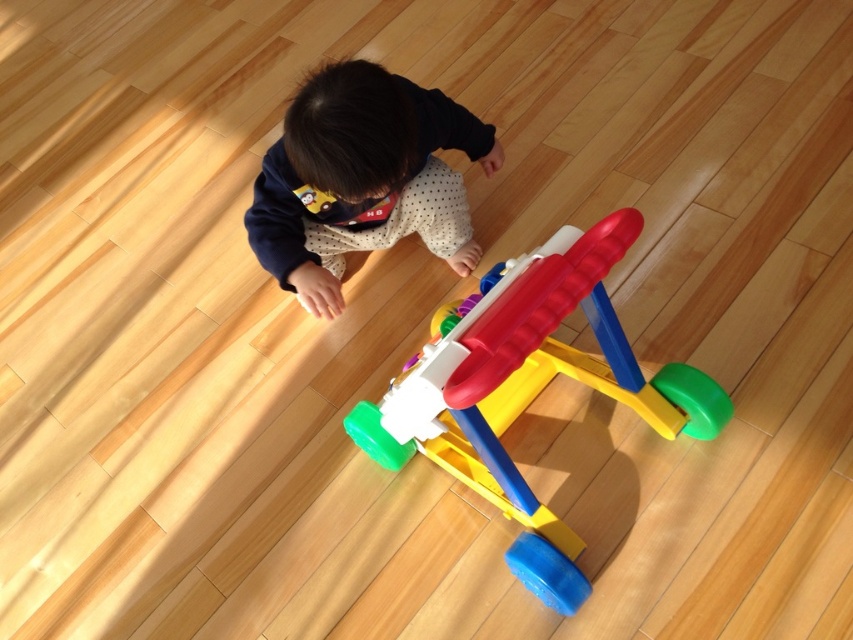
You are a parent who wants to ensure the plastic walker at center and the black matte shirt at upper center are placed in a way that the smaller item is not covered by the larger one. Which item should you place on top?

The plastic walker at center is bigger than the black matte shirt at upper center, so you should place the black matte shirt at upper center on top to ensure it is not covered.

You are a parent who wants to place a small toy on the floor between the plastic walker at center and the black matte shirt at upper center. The toy is 12 inches long. Can you fit it there without overlapping either object?

The plastic walker at center is 14.69 inches from the black matte shirt at upper center. Since the toy is 12 inches long, which is shorter than the distance between them, you can fit it between the plastic walker at center and the black matte shirt at upper center without overlapping either object.